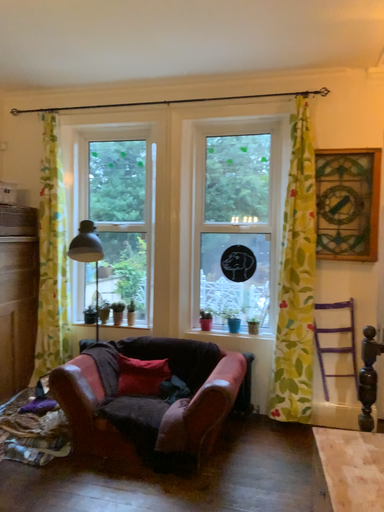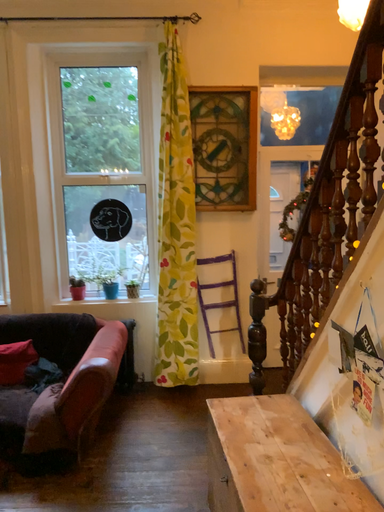
Question: How did the camera likely rotate when shooting the video?

Choices:
 (A) rotated left
 (B) rotated right

Answer: (B)